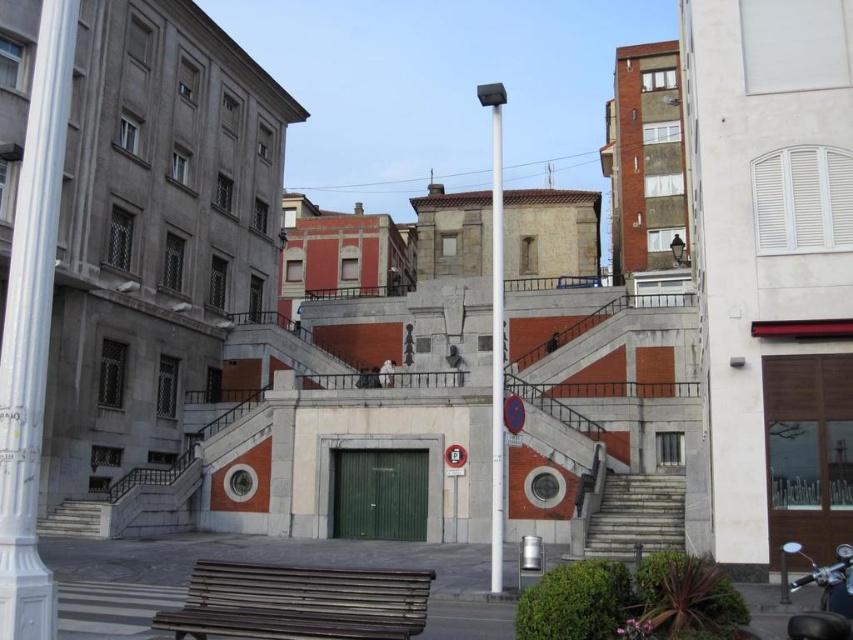
Question: Which point is closer to the camera?

Choices:
 (A) gray stone stairs at right
 (B) wooden bench at lower center

Answer: (B)

Question: Which object is farther from the camera taking this photo?

Choices:
 (A) polished metal pole at center
 (B) wooden bench at lower center
 (C) gray stone stairs at right

Answer: (C)

Question: Based on their relative distances, which object is farther from the polished metal pole at center?

Choices:
 (A) smooth concrete stairs at lower left
 (B) gray stone stairs at right

Answer: (A)

Question: Does white polished column at left lie in front of polished metal pole at center?

Choices:
 (A) no
 (B) yes

Answer: (B)

Question: Is white polished column at left to the left of wooden bench at lower center from the viewer's perspective?

Choices:
 (A) no
 (B) yes

Answer: (B)

Question: Does gray stone stairs at right appear under polished metal pole at center?

Choices:
 (A) yes
 (B) no

Answer: (A)